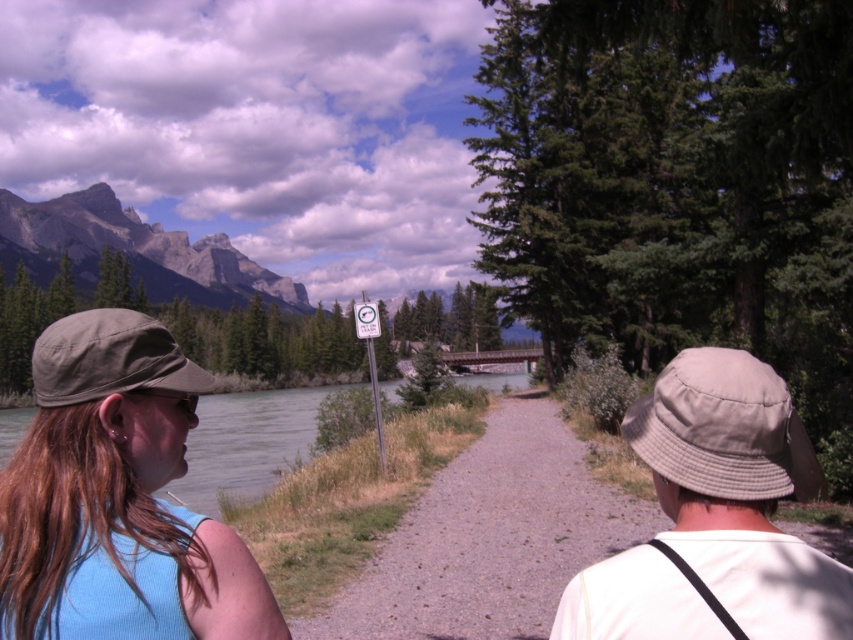
Question: Can you confirm if matte blue tank top at left is bigger than green fabric baseball cap at left?

Choices:
 (A) no
 (B) yes

Answer: (A)

Question: Which point appears closest to the camera in this image?

Choices:
 (A) (711, 410)
 (B) (724, 420)
 (C) (73, 403)

Answer: (B)

Question: Which of the following is the closest to the observer?

Choices:
 (A) tap(224, 625)
 (B) tap(36, 355)

Answer: (A)

Question: Which point is closer to the camera?

Choices:
 (A) (74, 387)
 (B) (717, 392)
 (C) (717, 419)
 (D) (99, 353)

Answer: (C)

Question: Is matte blue tank top at left thinner than light beige fabric bucket hat at center-right?

Choices:
 (A) no
 (B) yes

Answer: (A)

Question: Does tan fabric bucket hat at upper right have a greater width compared to green fabric baseball cap at left?

Choices:
 (A) no
 (B) yes

Answer: (A)